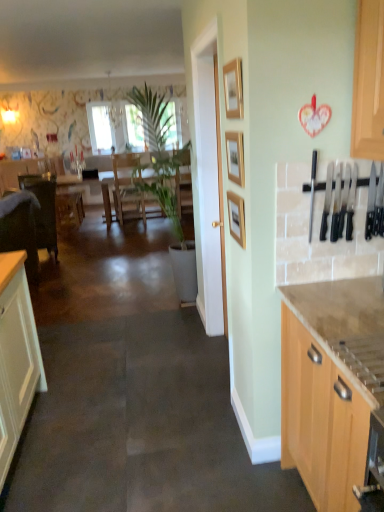
Question: From a real-world perspective, does light wood cabinet at right stand above wooden table at center?

Choices:
 (A) yes
 (B) no

Answer: (A)

Question: Considering the relative sizes of light wood cabinet at right and wooden table at center in the image provided, is light wood cabinet at right taller than wooden table at center?

Choices:
 (A) no
 (B) yes

Answer: (B)

Question: Is light wood cabinet at right directly adjacent to wooden table at center?

Choices:
 (A) no
 (B) yes

Answer: (A)

Question: Is light wood cabinet at right facing towards wooden table at center?

Choices:
 (A) no
 (B) yes

Answer: (A)

Question: Is light wood cabinet at right to the left of wooden table at center from the viewer's perspective?

Choices:
 (A) no
 (B) yes

Answer: (A)

Question: From the image's perspective, would you say light wood cabinet at right is positioned over wooden table at center?

Choices:
 (A) yes
 (B) no

Answer: (B)

Question: Considering the relative sizes of wooden table at center and wooden picture frame at upper center, the 2th picture frame from the bottom, in the image provided, is wooden table at center wider than wooden picture frame at upper center, the 2th picture frame from the bottom,?

Choices:
 (A) no
 (B) yes

Answer: (B)

Question: Would you consider wooden table at center to be distant from wooden picture frame at upper center, the 2th picture frame from the bottom?

Choices:
 (A) no
 (B) yes

Answer: (B)

Question: Is wooden picture frame at upper center, acting as the second picture frame starting from the top, inside wooden table at center?

Choices:
 (A) no
 (B) yes

Answer: (A)

Question: Is wooden table at center located outside wooden picture frame at upper center, acting as the second picture frame starting from the top?

Choices:
 (A) no
 (B) yes

Answer: (B)

Question: Considering the relative sizes of wooden table at center and wooden picture frame at upper center, the 2th picture frame from the bottom, in the image provided, is wooden table at center shorter than wooden picture frame at upper center, the 2th picture frame from the bottom,?

Choices:
 (A) yes
 (B) no

Answer: (B)

Question: Considering the relative positions of wooden table at center and wooden picture frame at upper center, acting as the second picture frame starting from the top, in the image provided, is wooden table at center to the right of wooden picture frame at upper center, acting as the second picture frame starting from the top, from the viewer's perspective?

Choices:
 (A) no
 (B) yes

Answer: (A)

Question: From a real-world perspective, is light wood cabinet at right under wooden picture frame at center, the first picture frame ordered from the bottom?

Choices:
 (A) yes
 (B) no

Answer: (A)